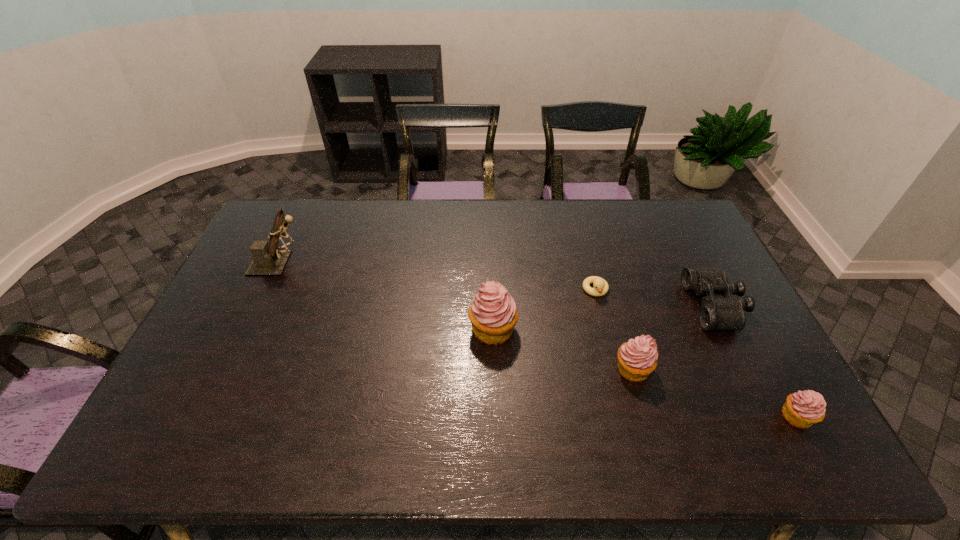
The width and height of the screenshot is (960, 540). I want to click on the leftmost cupcake, so click(x=493, y=314).

Locate an element on the screen. The height and width of the screenshot is (540, 960). the tallest cupcake is located at coordinates coord(493,314).

The width and height of the screenshot is (960, 540). In order to click on the second tallest cupcake in this screenshot , I will do `click(637, 358)`.

The image size is (960, 540). In order to click on the second nearest object in this screenshot , I will do `click(637, 358)`.

At what (x,y) coordinates should I click in order to perform the action: click on the shortest cupcake. Please return your answer as a coordinate pair (x, y). The height and width of the screenshot is (540, 960). Looking at the image, I should click on (802, 409).

You are a GUI agent. You are given a task and a screenshot of the screen. Output one action in this format:
    pyautogui.click(x=<x>, y=<y>)
    Task: Click on the rightmost cupcake
    
    Given the screenshot: What is the action you would take?
    coord(802,409)

Where is `binoculars`? This screenshot has width=960, height=540. binoculars is located at coordinates (716, 313).

Identify the location of the farthest object. The width and height of the screenshot is (960, 540). (269, 259).

You are a GUI agent. You are given a task and a screenshot of the screen. Output one action in this format:
    pyautogui.click(x=<x>, y=<y>)
    Task: Click on the figurine
    The height and width of the screenshot is (540, 960).
    Given the screenshot: What is the action you would take?
    pyautogui.click(x=269, y=259)

The width and height of the screenshot is (960, 540). Identify the location of duckling. (601, 287).